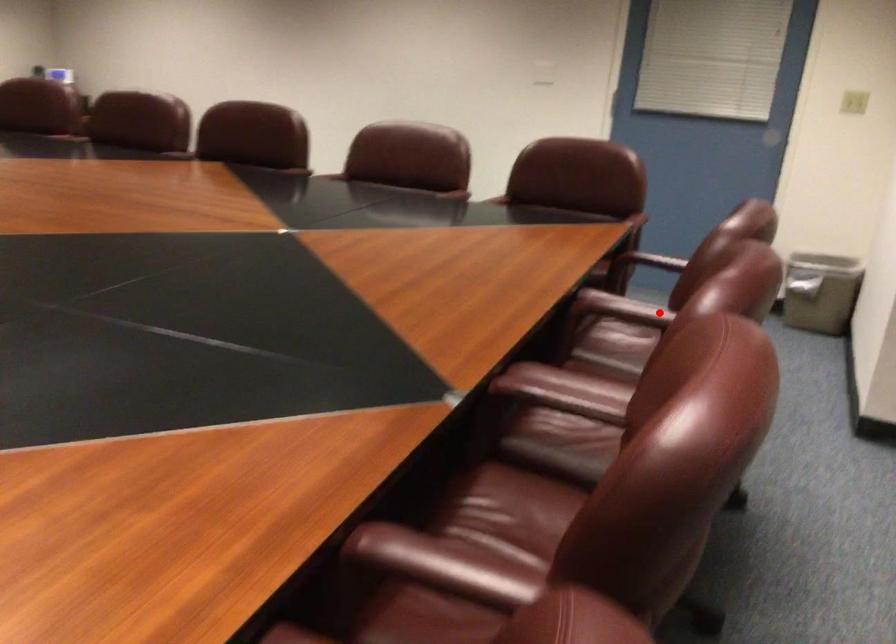
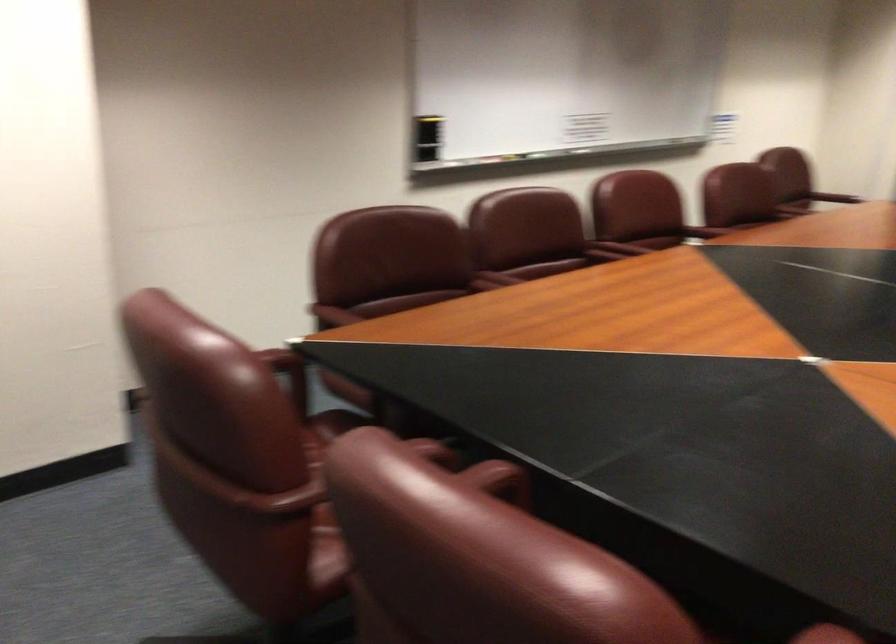
Where in the second image is the point corresponding to the highlighted location from the first image?

(497, 277)